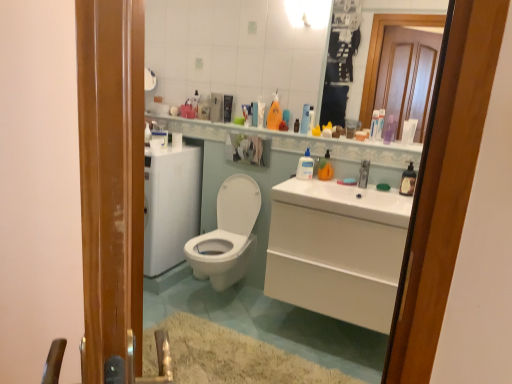
Identify the location of empty space that is ontop of white glossy shelf at upper center (from a real-world perspective). The width and height of the screenshot is (512, 384). [279, 129].